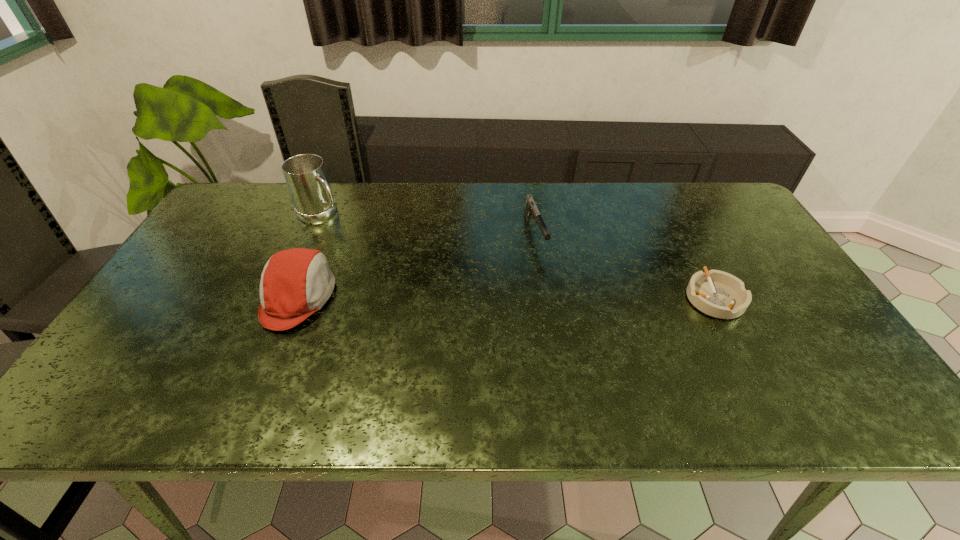
This screenshot has width=960, height=540. Find the location of `vacant space on the desktop that is between the cap and the rightmost object and is positioned at the muzzle end of the second object from right to left`. vacant space on the desktop that is between the cap and the rightmost object and is positioned at the muzzle end of the second object from right to left is located at coordinates click(564, 298).

Where is `vacant space on the desktop that is between the second tallest object and the rightmost object and is positioned on the side of the mug with the handle`? This screenshot has height=540, width=960. vacant space on the desktop that is between the second tallest object and the rightmost object and is positioned on the side of the mug with the handle is located at coordinates (445, 298).